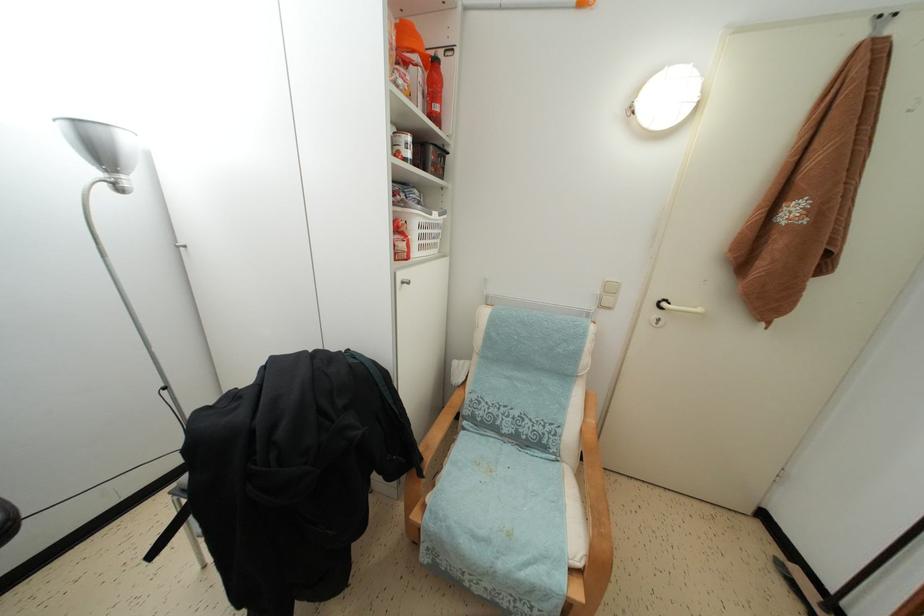
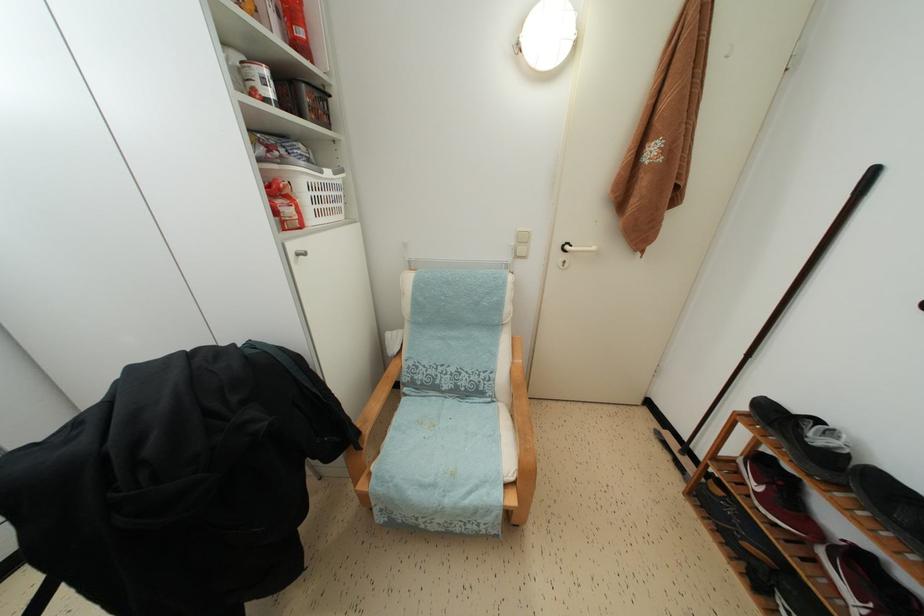
Find the pixel in the second image that matches (x=565, y=517) in the first image.

(502, 447)